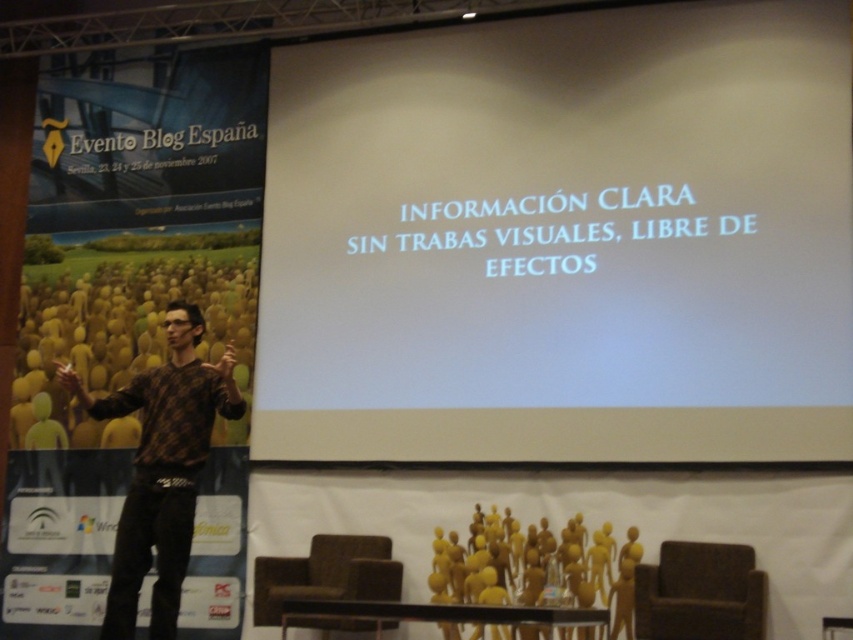
You are an attendee sitting in the brown fabric chair at lower right. You want to look at the white matte projection screen at center. Is the screen above or below your eye level?

The white matte projection screen at center is above the brown fabric chair at lower right, so it is above your eye level.

You are an attendee at the conference and want to take a photo of the white matte projection screen at center. However, you notice the brown textured sweater at center is blocking your view. Can you determine if the screen is visible above or below the sweater?

The white matte projection screen at center is positioned over the brown textured sweater at center, so the screen is visible above the sweater.